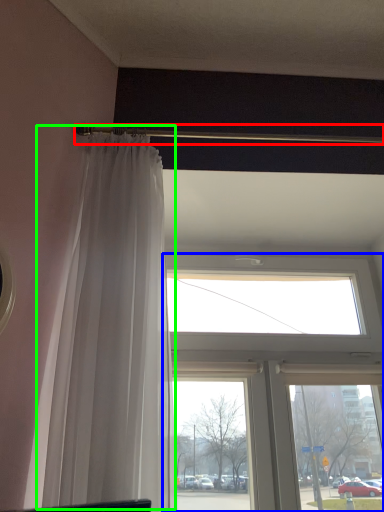
Question: Estimate the real-world distances between objects in this image. Which object is farther from beam (highlighted by a red box), window (highlighted by a blue box) or curtain (highlighted by a green box)?

Choices:
 (A) window
 (B) curtain

Answer: (A)